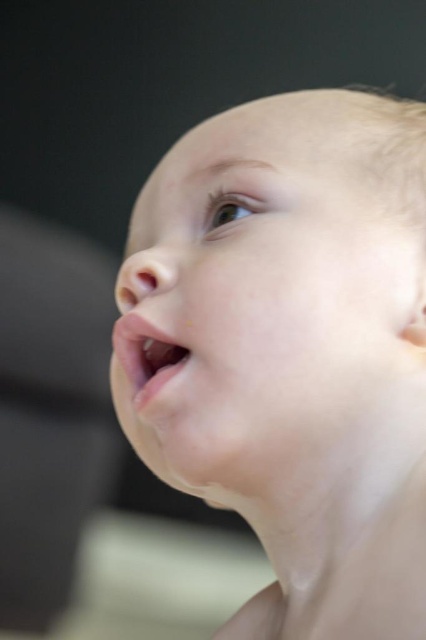
You are a photographer adjusting the focus on a camera. You have two points in the image, point 1 at coordinates point (195, 138) and point 2 at coordinates point (176, 362). If you want to focus on the point that is closer to the camera, which point should you choose?

Point 2 at coordinates point (176, 362) is closer to the camera than point 1 at coordinates point (195, 138), so you should focus on point 2 at coordinates point (176, 362).

You are a photographer adjusting the lighting for a baby portrait. You need to place a small light source at the point labeled point (258, 296). Based on the scene description, where exactly on the baby would this light be placed?

The point (258, 296) is on the smooth skin face at center, so the light would be placed on the baby face at center.

Based on the scene description, can you determine which object is located higher on the baby face, the smooth skin face at center or the pink smooth lips at center?

The smooth skin face at center is positioned over the pink smooth lips at center, so the smooth skin face at center is higher on the baby face.